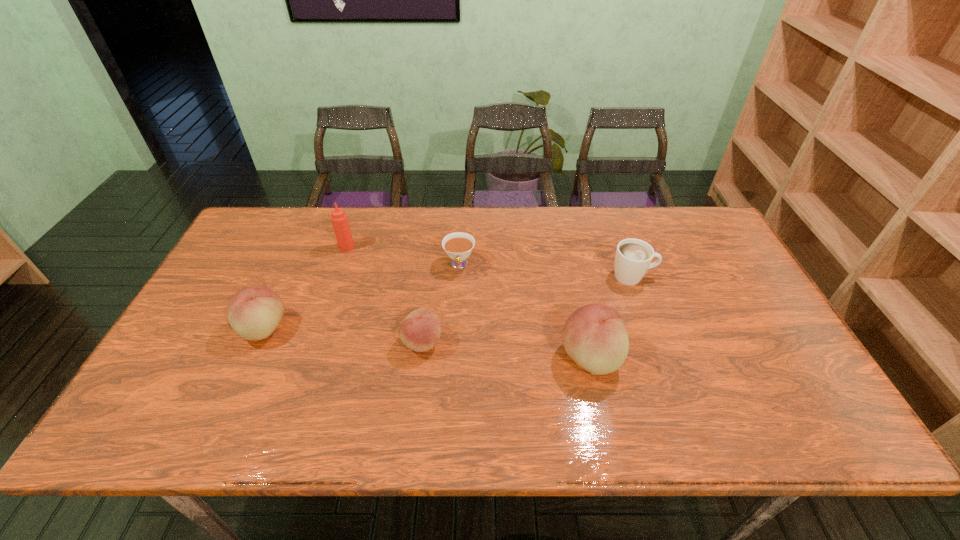
The image size is (960, 540). In the image, there is a desktop. Find the location of `vacant space at the left edge`. vacant space at the left edge is located at coordinates (237, 252).

Where is `free space at the right edge of the desktop`? The width and height of the screenshot is (960, 540). free space at the right edge of the desktop is located at coordinates (756, 304).

What are the coordinates of `vacant space at the far left corner of the desktop` in the screenshot? It's located at (298, 220).

Locate an element on the screen. The image size is (960, 540). blank space at the far right corner of the desktop is located at coordinates (701, 230).

Where is `vacant region between the fifth object from right to left and the shortest peach`? This screenshot has width=960, height=540. vacant region between the fifth object from right to left and the shortest peach is located at coordinates (384, 294).

At what (x,y) coordinates should I click in order to perform the action: click on unoccupied area between the leftmost object and the rightmost object. Please return your answer as a coordinate pair (x, y). This screenshot has width=960, height=540. Looking at the image, I should click on (448, 302).

Locate an element on the screen. vacant space in between the Tabasco sauce and the rightmost peach is located at coordinates (468, 302).

Find the location of a particular element. Image resolution: width=960 pixels, height=540 pixels. free space between the farthest object and the teacup is located at coordinates (403, 256).

Find the location of a particular element. The width and height of the screenshot is (960, 540). vacant space in between the tallest peach and the farthest object is located at coordinates (468, 302).

This screenshot has height=540, width=960. What are the coordinates of `empty location between the farthest object and the rightmost object` in the screenshot? It's located at (490, 261).